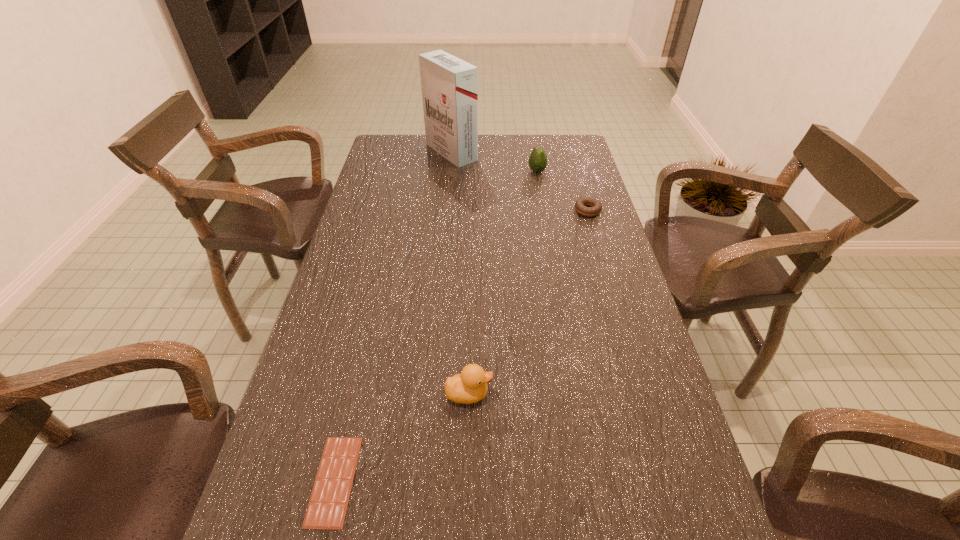
Identify the location of free space located 0.070m on the back of the fourth tallest object. The width and height of the screenshot is (960, 540). (582, 191).

Where is `free location located on the back of the shortest object`? free location located on the back of the shortest object is located at coordinates (370, 328).

This screenshot has height=540, width=960. In order to click on object that is positioned at the far edge in this screenshot , I will do `click(449, 85)`.

Where is `object located in the left edge section of the desktop`? object located in the left edge section of the desktop is located at coordinates (327, 507).

Identify the location of avocado that is positioned at the right edge. This screenshot has height=540, width=960. (537, 162).

At what (x,y) coordinates should I click in order to perform the action: click on doughnut at the right edge. Please return your answer as a coordinate pair (x, y). The height and width of the screenshot is (540, 960). Looking at the image, I should click on (595, 207).

Locate an element on the screen. free region at the far edge is located at coordinates (434, 163).

Find the location of `vacant space at the left edge of the desktop`. vacant space at the left edge of the desktop is located at coordinates (348, 325).

In the image, there is a desktop. Identify the location of vacant space at the right edge. (625, 299).

The width and height of the screenshot is (960, 540). What are the coordinates of `vacant area between the duckling and the third nearest object` in the screenshot? It's located at (528, 302).